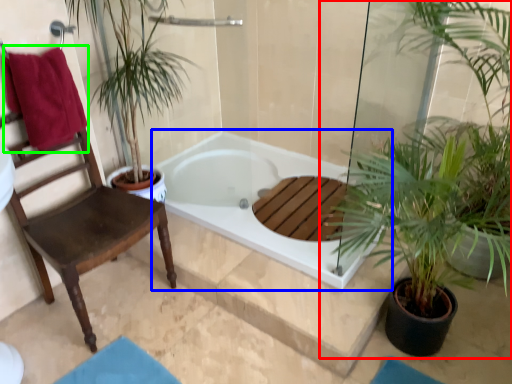
Question: Estimate the real-world distances between objects in this image. Which object is farther from houseplant (highlighted by a red box), bathtub (highlighted by a blue box) or beach towel (highlighted by a green box)?

Choices:
 (A) bathtub
 (B) beach towel

Answer: (B)